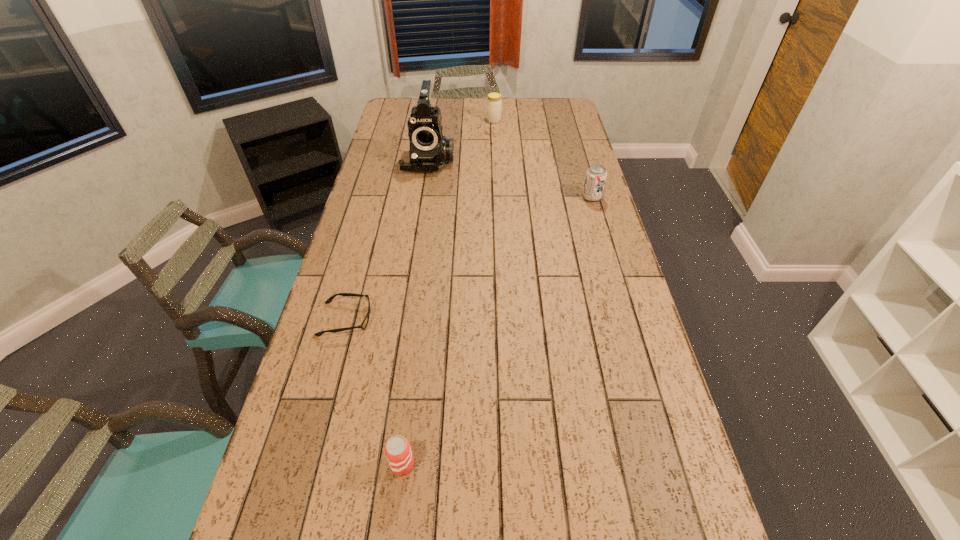
In the image, there is a desktop. Where is `free space at the left edge`? Image resolution: width=960 pixels, height=540 pixels. free space at the left edge is located at coordinates pyautogui.click(x=377, y=227).

Where is `vacant space at the right edge of the desktop`? This screenshot has height=540, width=960. vacant space at the right edge of the desktop is located at coordinates (588, 155).

This screenshot has width=960, height=540. In the image, there is a desktop. In order to click on vacant space at the far right corner in this screenshot , I will do `click(569, 105)`.

Locate an element on the screen. free spot between the left beer can and the shortest object is located at coordinates (374, 392).

Where is `vacant space that's between the right beer can and the spectacles`? The height and width of the screenshot is (540, 960). vacant space that's between the right beer can and the spectacles is located at coordinates (468, 259).

The image size is (960, 540). Identify the location of free space between the spectacles and the shorter beer can. (374, 392).

Locate an element on the screen. This screenshot has width=960, height=540. free space between the camcorder and the shorter beer can is located at coordinates (416, 312).

The width and height of the screenshot is (960, 540). In order to click on free point between the tallest object and the second object from right to left in this screenshot , I will do `click(462, 140)`.

Where is `free space between the third farthest object and the fourth object from left to right`? This screenshot has width=960, height=540. free space between the third farthest object and the fourth object from left to right is located at coordinates (542, 159).

Locate an element on the screen. The height and width of the screenshot is (540, 960). vacant area that lies between the second farthest object and the right beer can is located at coordinates (510, 179).